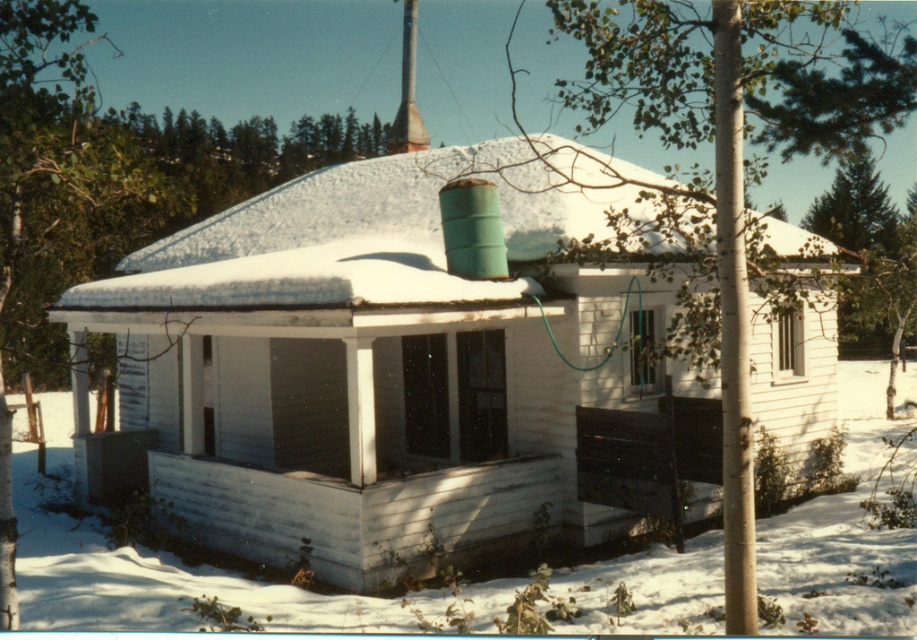
You are standing in front of the house and notice a green leafy tree at upper left and white shingles at upper center. Which object is located to the left of the other?

The green leafy tree at upper left is positioned on the left side of white shingles at upper center.